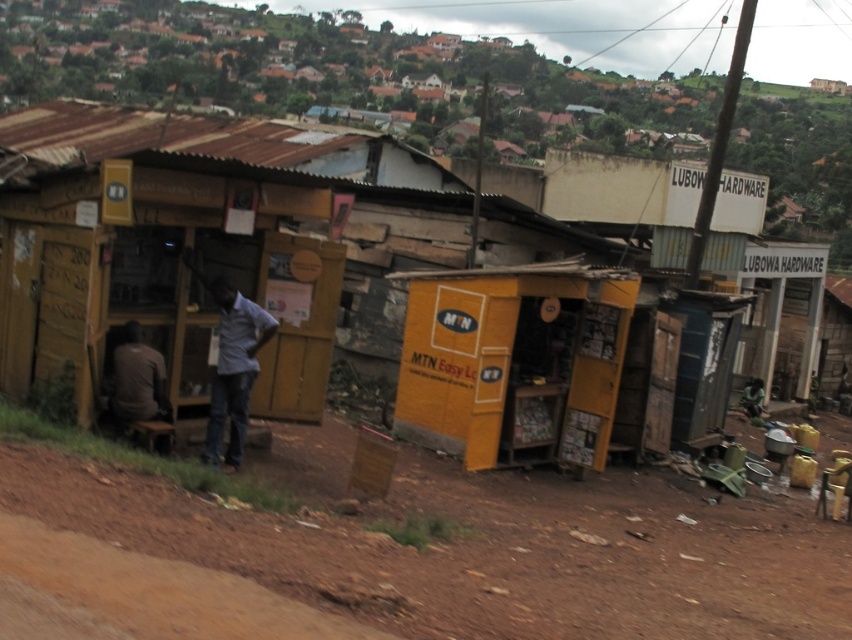
Does light gray shirt at center have a larger size compared to dark brown shirt at left?

Yes.

At what (x,y) coordinates should I click in order to perform the action: click on light gray shirt at center. Please return your answer as a coordinate pair (x, y). The height and width of the screenshot is (640, 852). Looking at the image, I should click on [233, 368].

Locate an element on the screen. This screenshot has height=640, width=852. light gray shirt at center is located at coordinates (233, 368).

Is point (344, 632) less distant than point (213, 417)?

Yes, point (344, 632) is in front of point (213, 417).

Is brown dirt track at lower left further to the viewer compared to light gray shirt at center?

No, it is in front of light gray shirt at center.

The height and width of the screenshot is (640, 852). Find the location of `brown dirt track at lower left`. brown dirt track at lower left is located at coordinates (407, 554).

Between point (262, 532) and point (145, 353), which one is positioned behind?

The point (145, 353) is behind.

Who is positioned more to the left, brown dirt track at lower left or dark brown shirt at left?

dark brown shirt at left is more to the left.

The height and width of the screenshot is (640, 852). What do you see at coordinates (407, 554) in the screenshot?
I see `brown dirt track at lower left` at bounding box center [407, 554].

Locate an element on the screen. This screenshot has width=852, height=640. brown dirt track at lower left is located at coordinates (407, 554).